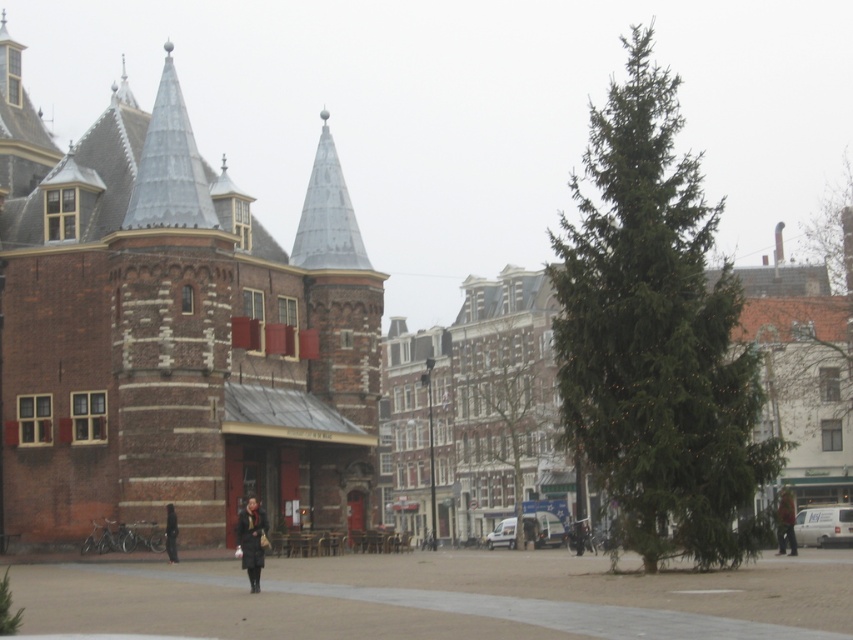
Who is more distant from viewer, [817,220] or [173,518]?

The point [817,220] is behind.

Which of these two, green matte tree at upper right or dark gray coat at center, stands shorter?

dark gray coat at center is shorter.

Who is more distant from viewer, (819, 221) or (172, 512)?

The point (819, 221) is behind.

Where is `green matte tree at upper right`? The image size is (853, 640). green matte tree at upper right is located at coordinates (833, 236).

Who is lower down, smooth concrete pavement at center or dark brown leather coat at lower center?

smooth concrete pavement at center is lower down.

The width and height of the screenshot is (853, 640). What are the coordinates of `smooth concrete pavement at center` in the screenshot? It's located at (444, 596).

Looking at this image, can you confirm if green textured tree at center is positioned above dark brown leather jacket at lower right?

Yes, green textured tree at center is above dark brown leather jacket at lower right.

Based on the photo, can you confirm if green textured tree at center is shorter than dark brown leather jacket at lower right?

No, green textured tree at center is not shorter than dark brown leather jacket at lower right.

Does point (537, 419) lie in front of point (786, 531)?

No, it is not.

In order to click on green textured tree at center in this screenshot , I will do `click(500, 410)`.